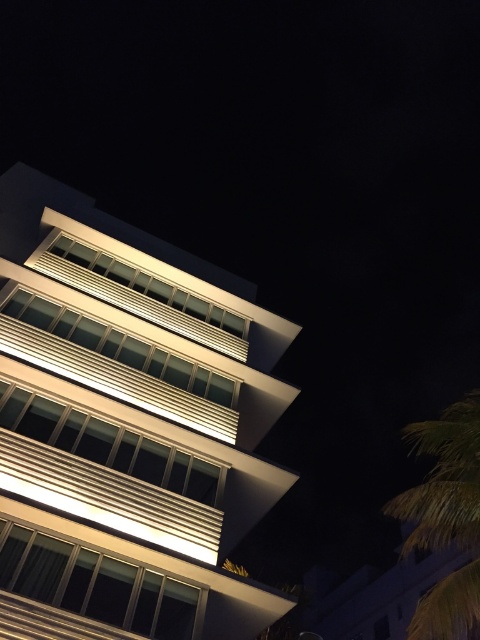
You are a drone operator tasked with flying a drone between the white glossy building at center and the green leafy palm tree at lower right. The drone has a maximum flight distance of 10 meters. Can the drone safely fly between these two objects without exceeding its range?

The white glossy building at center and the green leafy palm tree at lower right are 11.56 meters apart from each other. Since the drone can only fly up to 10 meters, it cannot safely fly between them without exceeding its range.

You are standing in front of a modern building at night. There is a point at coordinates point (128, 428). Based on the scene description, can you determine if this point is located on the white glossy building at center?

Yes, the point (128, 428) is on the white glossy building at center according to the description.

You are standing at the origin point of the coordinate system. The white glossy building at center is located at point 0.669, 0.267. If you want to move towards the building, which direction should you move in terms of the coordinate system?

To move towards the white glossy building at center located at point (128, 428) from the origin, you should move in the positive x and positive y direction since the building is in the positive quadrant of the coordinate system.